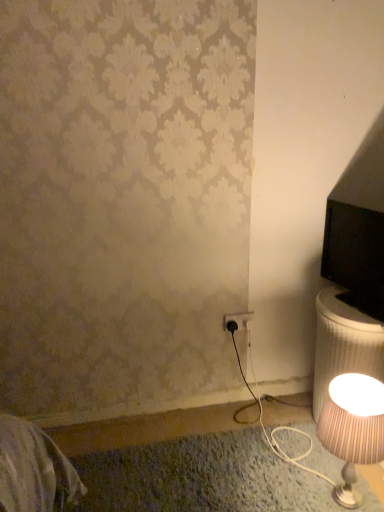
Find the location of a particular element. This screenshot has height=512, width=384. black plastic outlet at lower center is located at coordinates (238, 319).

In order to face black plastic outlet at lower center, should I rotate leftwards or rightwards?

Turn right by 6.403 degrees to look at black plastic outlet at lower center.

Image resolution: width=384 pixels, height=512 pixels. Describe the element at coordinates (238, 319) in the screenshot. I see `black plastic outlet at lower center` at that location.

The width and height of the screenshot is (384, 512). I want to click on striped fabric lampshade at lower right, so [353, 428].

The height and width of the screenshot is (512, 384). Describe the element at coordinates (353, 428) in the screenshot. I see `striped fabric lampshade at lower right` at that location.

In order to click on black plastic outlet at lower center in this screenshot , I will do `click(238, 319)`.

Which object is positioned more to the right, black plastic outlet at lower center or striped fabric lampshade at lower right?

Positioned to the right is striped fabric lampshade at lower right.

Which is behind, black plastic outlet at lower center or striped fabric lampshade at lower right?

black plastic outlet at lower center.

Is point (235, 315) positioned in front of point (324, 419)?

No, (235, 315) is further to viewer.

From the image's perspective, who appears lower, black plastic outlet at lower center or striped fabric lampshade at lower right?

striped fabric lampshade at lower right, from the image's perspective.

From a real-world perspective, does black plastic outlet at lower center stand above striped fabric lampshade at lower right?

Correct, in the physical world, black plastic outlet at lower center is higher than striped fabric lampshade at lower right.

Considering the relative sizes of black plastic outlet at lower center and striped fabric lampshade at lower right in the image provided, is black plastic outlet at lower center wider than striped fabric lampshade at lower right?

In fact, black plastic outlet at lower center might be narrower than striped fabric lampshade at lower right.

Does black plastic outlet at lower center have a lesser height compared to striped fabric lampshade at lower right?

Yes.

Considering the sizes of objects black plastic outlet at lower center and striped fabric lampshade at lower right in the image provided, who is bigger, black plastic outlet at lower center or striped fabric lampshade at lower right?

Bigger between the two is striped fabric lampshade at lower right.

Choose the correct answer: Is black plastic outlet at lower center inside striped fabric lampshade at lower right or outside it?

black plastic outlet at lower center is spatially situated outside striped fabric lampshade at lower right.

Is there a large distance between black plastic outlet at lower center and striped fabric lampshade at lower right?

No, black plastic outlet at lower center is not far from striped fabric lampshade at lower right.

Based on the photo, is black plastic outlet at lower center facing away from striped fabric lampshade at lower right?

No, black plastic outlet at lower center is not facing away from striped fabric lampshade at lower right.

Based on the photo, can you tell me how much black plastic outlet at lower center and striped fabric lampshade at lower right differ in facing direction?

The angle between the facing direction of black plastic outlet at lower center and the facing direction of striped fabric lampshade at lower right is 91.4 degrees.

What are the coordinates of `lamp on the right of black plastic outlet at lower center` in the screenshot? It's located at (353, 428).

Considering the positions of objects striped fabric lampshade at lower right and black plastic outlet at lower center in the image provided, who is more to the right, striped fabric lampshade at lower right or black plastic outlet at lower center?

striped fabric lampshade at lower right.

Does striped fabric lampshade at lower right come in front of black plastic outlet at lower center?

Yes, it is.

Is point (382, 407) more distant than point (241, 314)?

No.

From the image's perspective, which is below, striped fabric lampshade at lower right or black plastic outlet at lower center?

striped fabric lampshade at lower right, from the image's perspective.

From a real-world perspective, is striped fabric lampshade at lower right physically located above or below black plastic outlet at lower center?

Clearly, from a real-world perspective, striped fabric lampshade at lower right is below black plastic outlet at lower center.

Looking at this image, looking at their sizes, would you say striped fabric lampshade at lower right is wider or thinner than black plastic outlet at lower center?

striped fabric lampshade at lower right is wider than black plastic outlet at lower center.

Considering the sizes of objects striped fabric lampshade at lower right and black plastic outlet at lower center in the image provided, who is shorter, striped fabric lampshade at lower right or black plastic outlet at lower center?

With less height is black plastic outlet at lower center.

Considering the sizes of striped fabric lampshade at lower right and black plastic outlet at lower center in the image, is striped fabric lampshade at lower right bigger or smaller than black plastic outlet at lower center?

striped fabric lampshade at lower right is bigger than black plastic outlet at lower center.

Is striped fabric lampshade at lower right located outside black plastic outlet at lower center?

Indeed, striped fabric lampshade at lower right is completely outside black plastic outlet at lower center.

Is striped fabric lampshade at lower right positioned far away from black plastic outlet at lower center?

Actually, striped fabric lampshade at lower right and black plastic outlet at lower center are a little close together.

Is striped fabric lampshade at lower right positioned with its back to black plastic outlet at lower center?

No, black plastic outlet at lower center is not at the back of striped fabric lampshade at lower right.

In order to click on electric outlet above the striped fabric lampshade at lower right (from a real-world perspective) in this screenshot , I will do `click(238, 319)`.

In order to click on electric outlet above the striped fabric lampshade at lower right (from the image's perspective) in this screenshot , I will do `click(238, 319)`.

The image size is (384, 512). Identify the location of electric outlet on the left of the striped fabric lampshade at lower right. (238, 319).